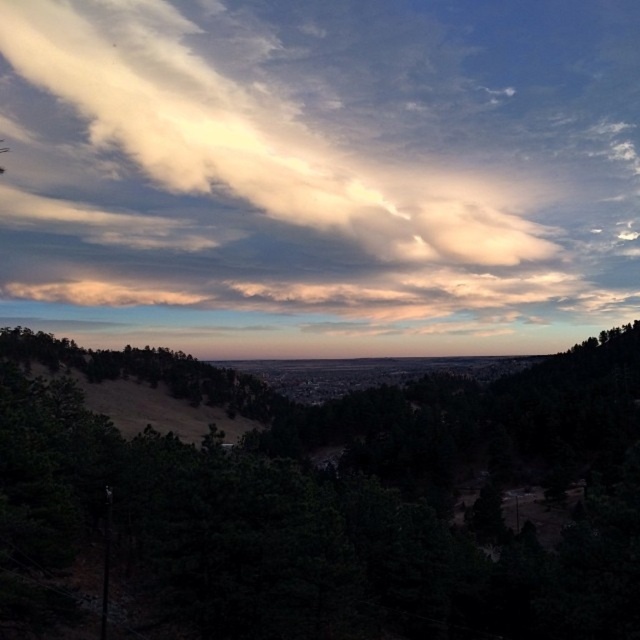
Does white fluffy cloud at upper center have a lesser height compared to dark green leafy tree at center?

No.

Who is higher up, white fluffy cloud at upper center or dark green leafy tree at center?

Positioned higher is white fluffy cloud at upper center.

Which is behind, point (504, 292) or point (58, 516)?

The point (504, 292) is more distant.

The height and width of the screenshot is (640, 640). Find the location of `white fluffy cloud at upper center`. white fluffy cloud at upper center is located at coordinates (321, 173).